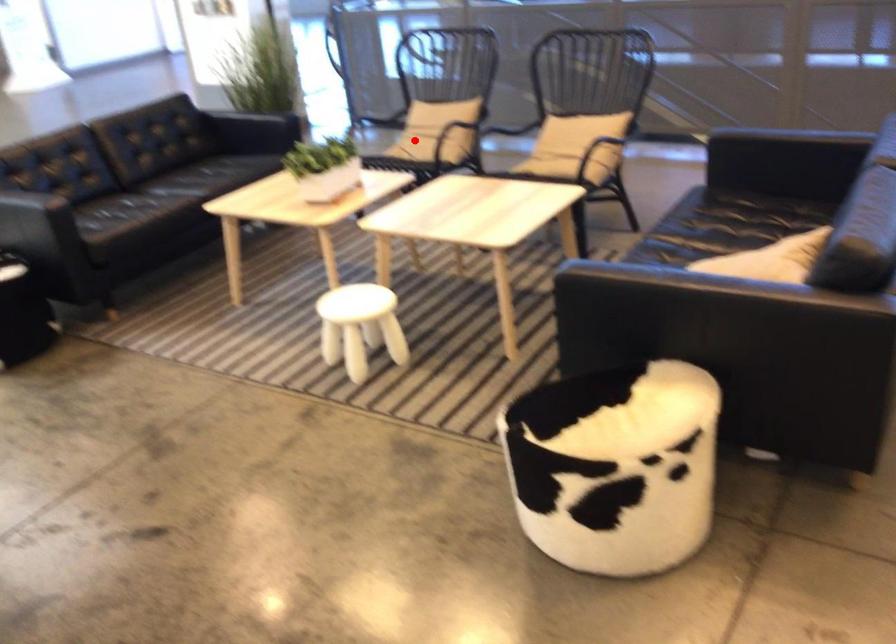
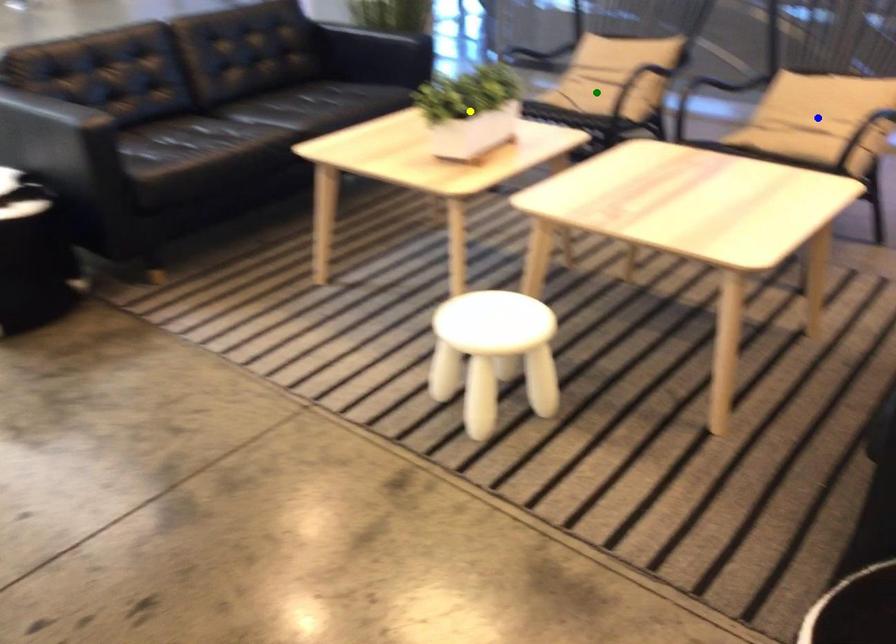
Question: I am providing you with two images of the same scene from different viewpoints. A red point is marked on the first image. You are given multiple points on the second image. Which spot in image 2 lines up with the point in image 1?

Choices:
 (A) green point
 (B) yellow point
 (C) blue point

Answer: (A)